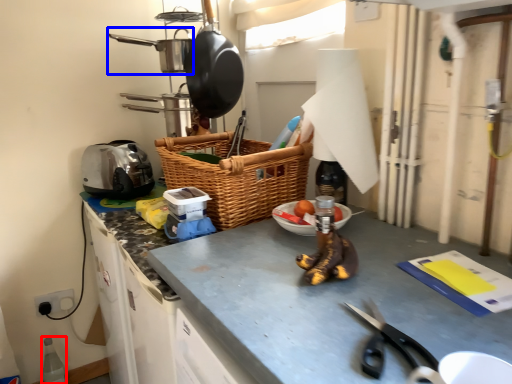
Question: Which point is further to the camera, bottle (highlighted by a red box) or frying pan (highlighted by a blue box)?

Choices:
 (A) bottle
 (B) frying pan

Answer: (A)